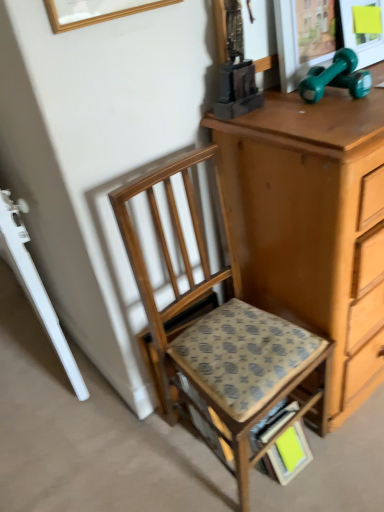
What do you see at coordinates (95, 11) in the screenshot?
I see `wooden picture frame at upper center` at bounding box center [95, 11].

The width and height of the screenshot is (384, 512). I want to click on wooden chair at center, so click(219, 334).

The width and height of the screenshot is (384, 512). Identify the location of patterned fabric step stool at center. (247, 369).

Locate an element on the screen. The height and width of the screenshot is (512, 384). wooden picture frame at upper center is located at coordinates (95, 11).

Is patterned fabric step stool at center further to camera compared to wooden picture frame at upper center?

Yes, patterned fabric step stool at center is further from the camera.

Which is more to the right, patterned fabric step stool at center or wooden picture frame at upper center?

From the viewer's perspective, patterned fabric step stool at center appears more on the right side.

Is patterned fabric step stool at center inside the boundaries of wooden picture frame at upper center, or outside?

patterned fabric step stool at center is located beyond the bounds of wooden picture frame at upper center.

Does point (321, 395) appear closer or farther from the camera than point (227, 384)?

Point (321, 395).

Is wooden chair at center aimed at patterned fabric step stool at center?

Yes, wooden chair at center is aimed at patterned fabric step stool at center.

From the image's perspective, is wooden chair at center located above or below patterned fabric step stool at center?

wooden chair at center is situated higher than patterned fabric step stool at center in the image.

Which is behind, wooden picture frame at upper center or patterned fabric step stool at center?

patterned fabric step stool at center is further away from the camera.

This screenshot has width=384, height=512. What are the coordinates of `picture frame lying on the left of patterned fabric step stool at center` in the screenshot? It's located at (95, 11).

Is wooden picture frame at upper center completely or partially outside of patterned fabric step stool at center?

That's correct, wooden picture frame at upper center is outside of patterned fabric step stool at center.

Looking at this image, considering the relative sizes of wooden picture frame at upper center and patterned fabric step stool at center in the image provided, is wooden picture frame at upper center bigger than patterned fabric step stool at center?

No.

Considering the sizes of objects wooden picture frame at upper center and wooden chair at center in the image provided, who is bigger, wooden picture frame at upper center or wooden chair at center?

wooden chair at center is bigger.

This screenshot has width=384, height=512. Identify the location of chair that is under the wooden picture frame at upper center (from a real-world perspective). (219, 334).

Is wooden picture frame at upper center aimed at wooden chair at center?

No, wooden picture frame at upper center is not facing towards wooden chair at center.

Can you confirm if wooden picture frame at upper center is positioned to the left of wooden chair at center?

Correct, you'll find wooden picture frame at upper center to the left of wooden chair at center.

Which of these two, patterned fabric step stool at center or wooden chair at center, is wider?

With larger width is wooden chair at center.

From the image's perspective, which one is positioned higher, patterned fabric step stool at center or wooden chair at center?

wooden chair at center.

You are a GUI agent. You are given a task and a screenshot of the screen. Output one action in this format:
    pyautogui.click(x=<x>, y=<y>)
    Task: Click on the step stool that appears on the right of wooden chair at center
    This screenshot has width=384, height=512.
    Given the screenshot: What is the action you would take?
    pyautogui.click(x=247, y=369)

Considering the sizes of objects wooden chair at center and wooden picture frame at upper center in the image provided, who is wider, wooden chair at center or wooden picture frame at upper center?

wooden chair at center.

This screenshot has width=384, height=512. Identify the location of picture frame lying on the left of wooden chair at center. (95, 11).

Can you tell me how much wooden chair at center and wooden picture frame at upper center differ in facing direction?

The angular difference between wooden chair at center and wooden picture frame at upper center is 0.751 degrees.

Could you tell me if wooden chair at center is turned towards wooden picture frame at upper center?

No, wooden chair at center is not facing towards wooden picture frame at upper center.

This screenshot has height=512, width=384. I want to click on step stool lying below the wooden picture frame at upper center (from the image's perspective), so click(x=247, y=369).

At what (x,y) coordinates should I click in order to perform the action: click on step stool that appears on the right of wooden chair at center. Please return your answer as a coordinate pair (x, y). This screenshot has width=384, height=512. Looking at the image, I should click on tap(247, 369).

From the image, which object appears to be farther from wooden chair at center, patterned fabric step stool at center or wooden picture frame at upper center?

wooden picture frame at upper center is positioned further to the anchor wooden chair at center.

From the image, which object appears to be nearer to wooden chair at center, wooden picture frame at upper center or patterned fabric step stool at center?

Among the two, patterned fabric step stool at center is located nearer to wooden chair at center.

Based on their spatial positions, is wooden chair at center or patterned fabric step stool at center closer to wooden picture frame at upper center?

The object closer to wooden picture frame at upper center is wooden chair at center.

Looking at the image, which one is located further to wooden picture frame at upper center, patterned fabric step stool at center or wooden chair at center?

Among the two, patterned fabric step stool at center is located further to wooden picture frame at upper center.

Considering their positions, is wooden picture frame at upper center positioned further to patterned fabric step stool at center than wooden chair at center?

Among the two, wooden picture frame at upper center is located further to patterned fabric step stool at center.

From the image, which object appears to be farther from patterned fabric step stool at center, wooden chair at center or wooden picture frame at upper center?

wooden picture frame at upper center lies further to patterned fabric step stool at center than the other object.

Where is `chair that lies between wooden picture frame at upper center and patterned fabric step stool at center from top to bottom`? This screenshot has height=512, width=384. chair that lies between wooden picture frame at upper center and patterned fabric step stool at center from top to bottom is located at coordinates (219, 334).